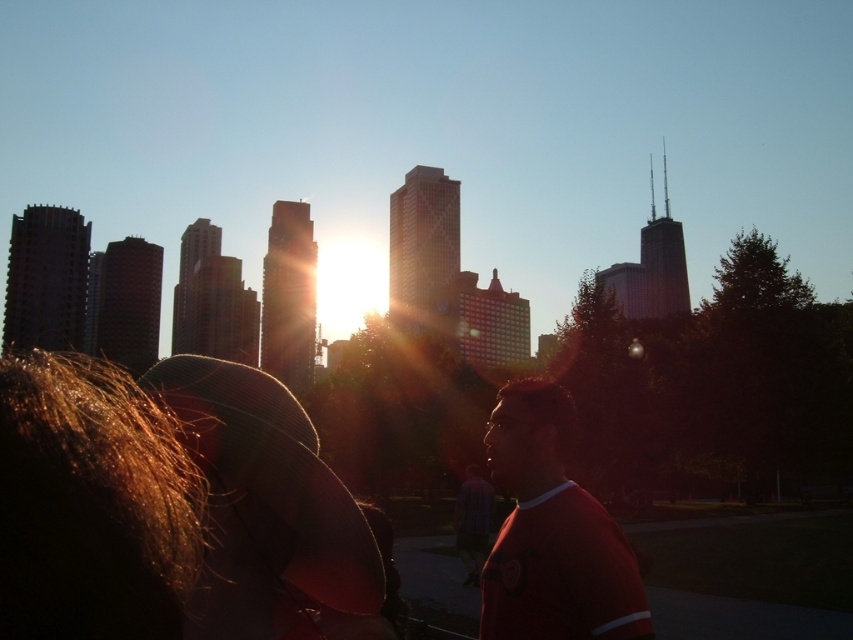
Question: Can you confirm if shiny brown hair at lower left is positioned below red matte shirt at center?

Choices:
 (A) yes
 (B) no

Answer: (B)

Question: Based on their relative distances, which object is nearer to the red matte shirt at center?

Choices:
 (A) shiny brown hair at lower left
 (B) blue striped shirt at center

Answer: (B)

Question: Which point is closer to the camera?

Choices:
 (A) (73, 410)
 (B) (532, 445)
 (C) (485, 508)

Answer: (A)

Question: Which object appears closest to the camera in this image?

Choices:
 (A) shiny brown hair at lower left
 (B) red matte shirt at center
 (C) blue striped shirt at center

Answer: (A)

Question: Can you confirm if shiny brown hair at lower left is wider than red matte shirt at center?

Choices:
 (A) yes
 (B) no

Answer: (B)

Question: Does shiny brown hair at lower left have a smaller size compared to blue striped shirt at center?

Choices:
 (A) no
 (B) yes

Answer: (A)